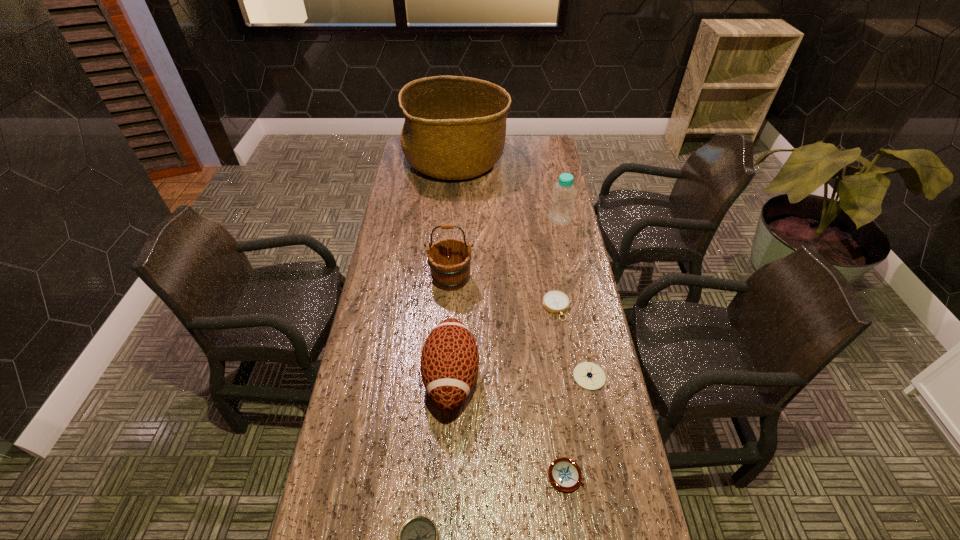
In order to click on vacant space that's between the seventh farthest object and the basket in this screenshot , I will do `click(511, 318)`.

This screenshot has width=960, height=540. What are the coordinates of `empty space between the bottle and the wine bucket` in the screenshot? It's located at (505, 249).

You are a GUI agent. You are given a task and a screenshot of the screen. Output one action in this format:
    pyautogui.click(x=<x>, y=<y>)
    Task: Click on the object that is the closest to the farthest compass
    This screenshot has height=540, width=960.
    Given the screenshot: What is the action you would take?
    pyautogui.click(x=588, y=375)

Identify which object is located as the fifth nearest to the second nearest compass. Please provide its 2D coordinates. Your answer should be formatted as a tuple, i.e. [(x, y)], where the tuple contains the x and y coordinates of a point satisfying the conditions above.

[(449, 260)]

What are the coordinates of `compass that stands as the fourth closest to the seventh shortest object` in the screenshot? It's located at (418, 539).

The width and height of the screenshot is (960, 540). What are the coordinates of `compass object that ranks as the second closest to the farthest compass` in the screenshot? It's located at (564, 473).

The image size is (960, 540). Find the location of `free space that satisfies the following two spatial constraints: 1. on the front side of the third farthest compass; 2. on the right side of the basket`. free space that satisfies the following two spatial constraints: 1. on the front side of the third farthest compass; 2. on the right side of the basket is located at coordinates (433, 475).